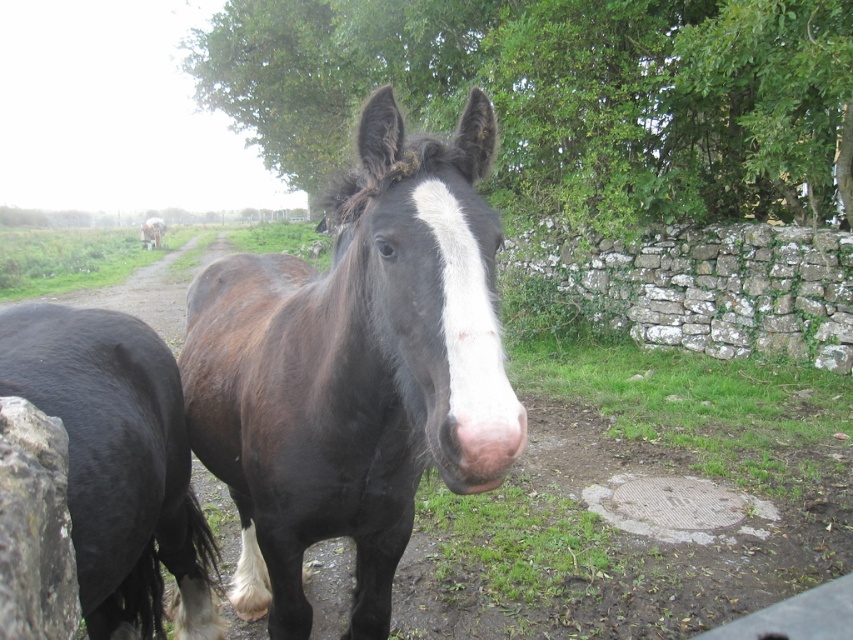
Question: Among these points, which one is farthest from the camera?

Choices:
 (A) (654, 264)
 (B) (68, 492)
 (C) (451, 156)

Answer: (A)

Question: Among these points, which one is farthest from the camera?

Choices:
 (A) (328, 346)
 (B) (555, 243)

Answer: (B)

Question: Is black glossy horse at left closer to camera compared to white glossy donkey at center?

Choices:
 (A) no
 (B) yes

Answer: (B)

Question: Is black glossy horse at left wider than weathered stone wall at center-right?

Choices:
 (A) yes
 (B) no

Answer: (B)

Question: Does black glossy horse at left have a smaller size compared to white glossy donkey at center?

Choices:
 (A) yes
 (B) no

Answer: (A)

Question: Which object is farther from the camera taking this photo?

Choices:
 (A) black glossy horse at left
 (B) shiny brown horse at center
 (C) weathered stone wall at center-right

Answer: (C)